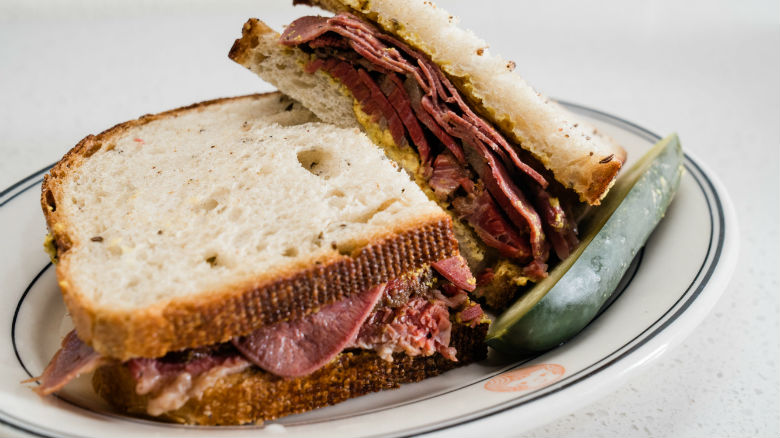
Where is `plate`? plate is located at coordinates (653, 302).